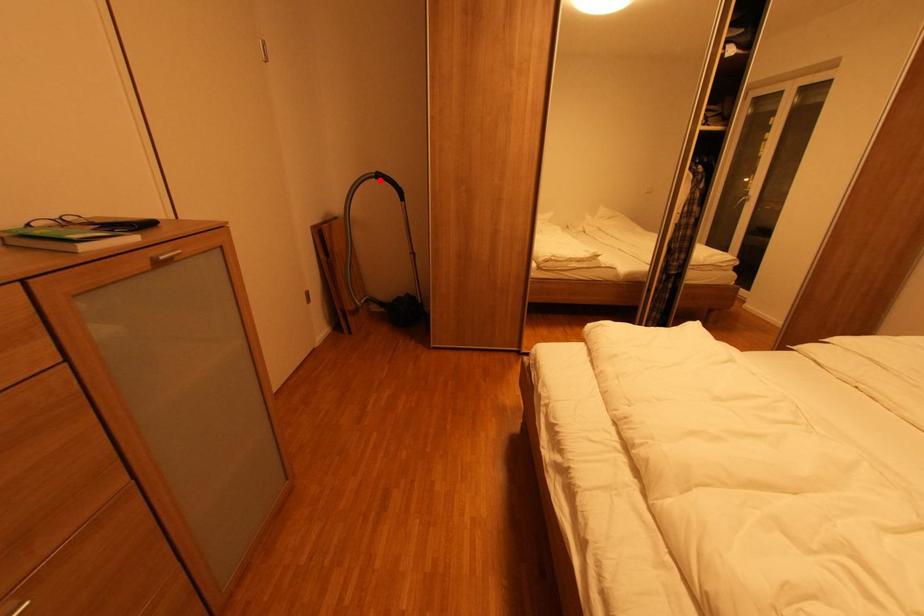
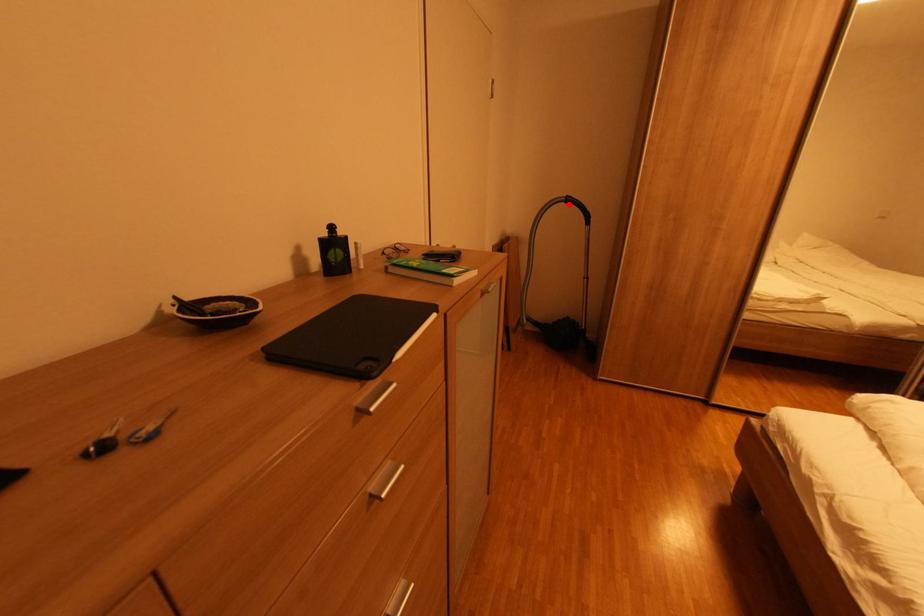
I am providing you with two images of the same scene from different viewpoints. A red point is marked on the first image and another point is marked on the second image. Are the points marked in image1 and image2 representing the same 3D position?

Yes